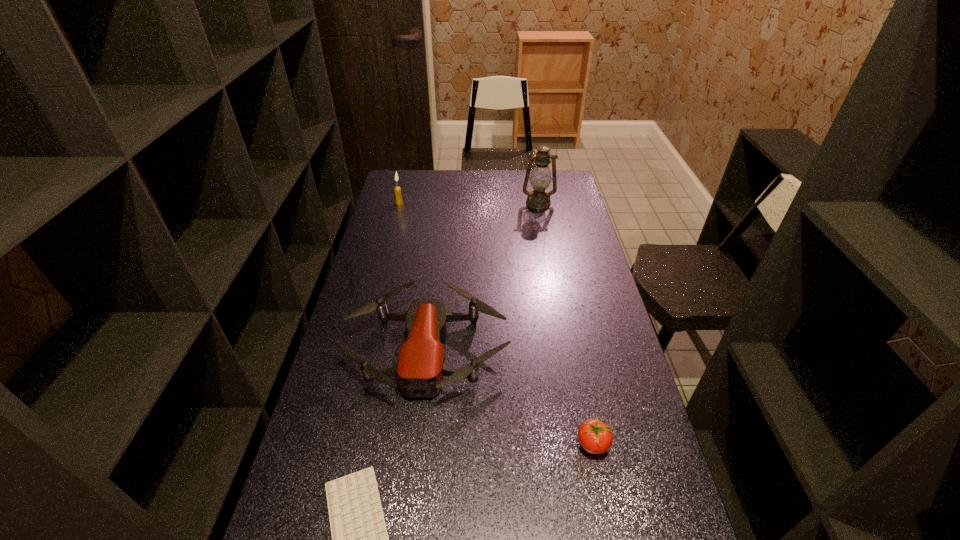
Where is `oil lamp`? This screenshot has height=540, width=960. oil lamp is located at coordinates (540, 179).

Find the location of a particular element. The width and height of the screenshot is (960, 540). candle is located at coordinates (397, 190).

Where is `drone`? drone is located at coordinates (420, 368).

At what (x,y) coordinates should I click in order to perform the action: click on the third farthest object. Please return your answer as a coordinate pair (x, y). The height and width of the screenshot is (540, 960). Looking at the image, I should click on (420, 368).

This screenshot has width=960, height=540. In order to click on the fourth tallest object in this screenshot , I will do `click(595, 437)`.

Where is `tomato`? Image resolution: width=960 pixels, height=540 pixels. tomato is located at coordinates (595, 437).

Locate an element on the screen. This screenshot has height=540, width=960. vacant area located 0.360m on the left of the oil lamp is located at coordinates (444, 202).

Identify the location of free location located on the front of the fourth shortest object. Image resolution: width=960 pixels, height=540 pixels. (386, 255).

Where is `vacant area situated on the front-facing side of the third tallest object`? This screenshot has width=960, height=540. vacant area situated on the front-facing side of the third tallest object is located at coordinates [x=418, y=425].

Find the location of a particular element. The width and height of the screenshot is (960, 540). vacant space located on the back of the tomato is located at coordinates (574, 353).